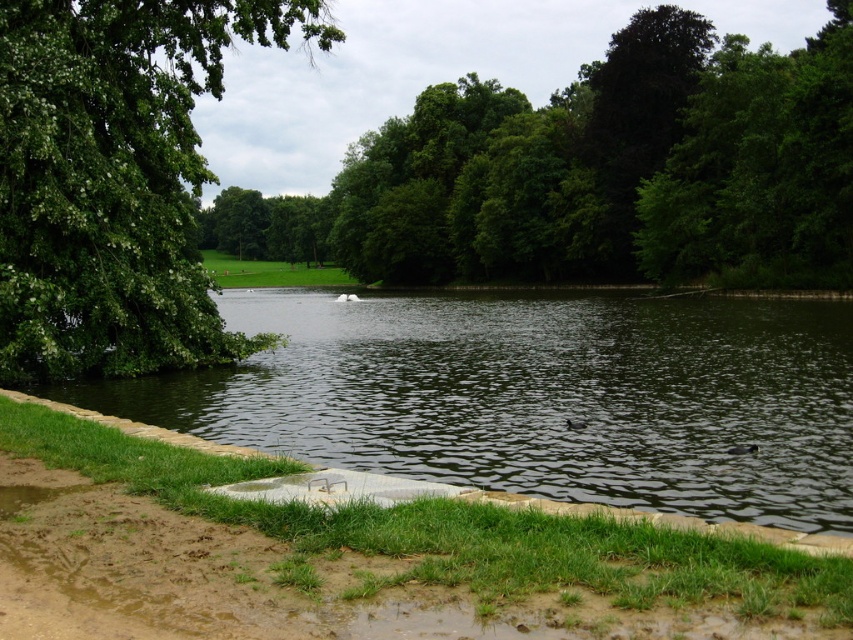
Describe the element at coordinates (595, 172) in the screenshot. This screenshot has width=853, height=640. I see `green leafy tree at upper center` at that location.

Is point (469, 227) positioned before point (21, 42)?

No, it is behind (21, 42).

Find the location of a particular element. green leafy tree at upper center is located at coordinates (595, 172).

Is dark green water at center thinner than green leafy tree at upper center?

Yes.

Image resolution: width=853 pixels, height=640 pixels. Describe the element at coordinates (537, 396) in the screenshot. I see `dark green water at center` at that location.

Where is `dark green water at center`? Image resolution: width=853 pixels, height=640 pixels. dark green water at center is located at coordinates (x=537, y=396).

Is dark green water at center taller than green leafy tree at upper left?

Incorrect, dark green water at center's height is not larger of green leafy tree at upper left's.

Based on the photo, between dark green water at center and green leafy tree at upper left, which one appears on the right side from the viewer's perspective?

dark green water at center

Which is in front, point (749, 502) or point (257, 1)?

Point (749, 502)

Where is `dark green water at center`? dark green water at center is located at coordinates (537, 396).